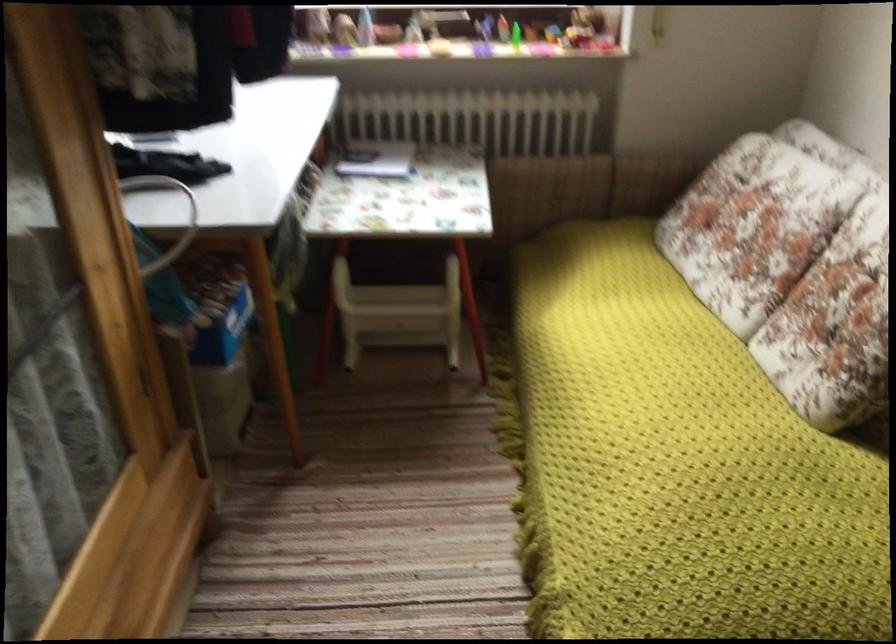
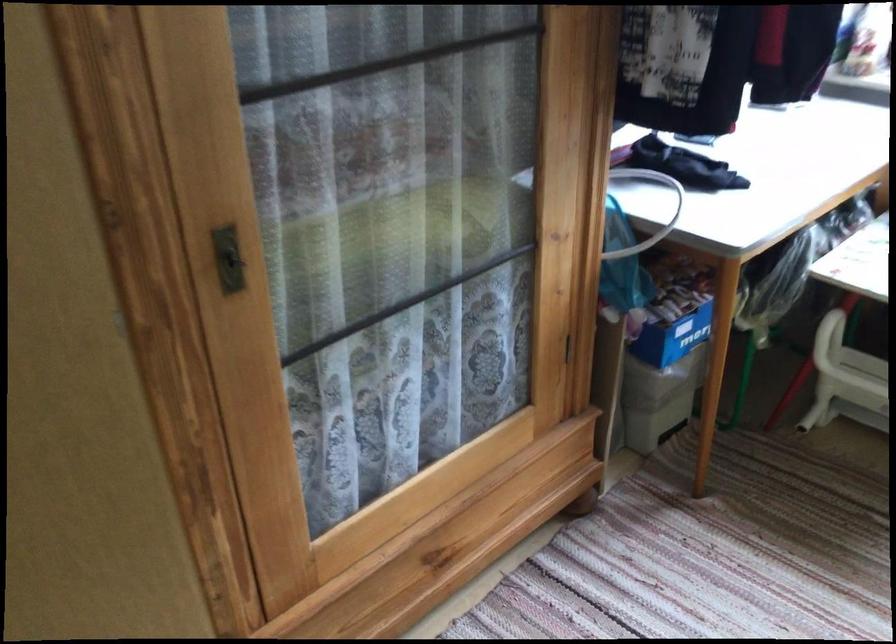
Question: How did the camera likely rotate?

Choices:
 (A) Left
 (B) Right
 (C) Up
 (D) Down

Answer: (A)